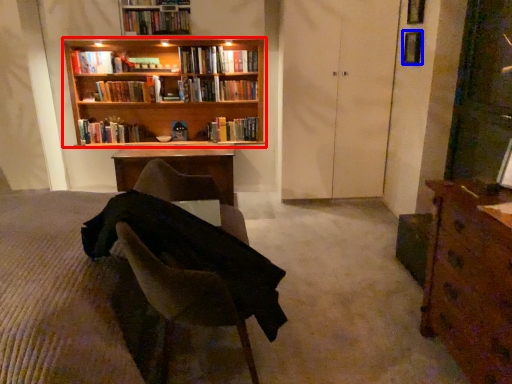
Question: Which of the following is the farthest to the observer, bookcase (highlighted by a red box) or window (highlighted by a blue box)?

Choices:
 (A) bookcase
 (B) window

Answer: (A)